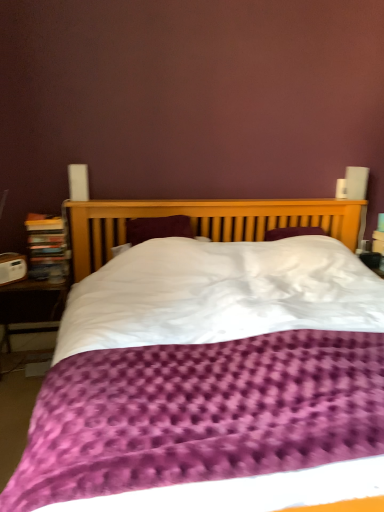
Question: From a real-world perspective, is purple textured duvet at center beneath wooden table at lower left?

Choices:
 (A) no
 (B) yes

Answer: (A)

Question: From a real-world perspective, does purple textured duvet at center stand above wooden table at lower left?

Choices:
 (A) no
 (B) yes

Answer: (B)

Question: Considering the relative positions of purple textured duvet at center and wooden table at lower left in the image provided, is purple textured duvet at center behind wooden table at lower left?

Choices:
 (A) no
 (B) yes

Answer: (A)

Question: Would you consider purple textured duvet at center to be distant from wooden table at lower left?

Choices:
 (A) no
 (B) yes

Answer: (A)

Question: Does purple textured duvet at center have a greater width compared to wooden table at lower left?

Choices:
 (A) no
 (B) yes

Answer: (B)

Question: In terms of size, does wooden bookcase at left appear bigger or smaller than wooden table at lower left?

Choices:
 (A) big
 (B) small

Answer: (B)

Question: Based on their positions, is wooden bookcase at left located to the left or right of wooden table at lower left?

Choices:
 (A) left
 (B) right

Answer: (B)

Question: Is wooden bookcase at left in front of or behind wooden table at lower left in the image?

Choices:
 (A) front
 (B) behind

Answer: (B)

Question: Is wooden bookcase at left taller or shorter than wooden table at lower left?

Choices:
 (A) tall
 (B) short

Answer: (B)

Question: In the image, is wooden table at lower left positioned in front of or behind purple textured duvet at center?

Choices:
 (A) front
 (B) behind

Answer: (B)

Question: Is wooden table at lower left bigger or smaller than purple textured duvet at center?

Choices:
 (A) big
 (B) small

Answer: (B)

Question: Is point (26, 331) closer or farther from the camera than point (302, 489)?

Choices:
 (A) farther
 (B) closer

Answer: (A)

Question: Based on their positions, is wooden table at lower left located to the left or right of purple textured duvet at center?

Choices:
 (A) left
 (B) right

Answer: (A)

Question: Is purple textured duvet at center inside the boundaries of wooden table at lower left, or outside?

Choices:
 (A) outside
 (B) inside

Answer: (A)

Question: Is point (201, 230) positioned closer to the camera than point (57, 292)?

Choices:
 (A) closer
 (B) farther

Answer: (B)